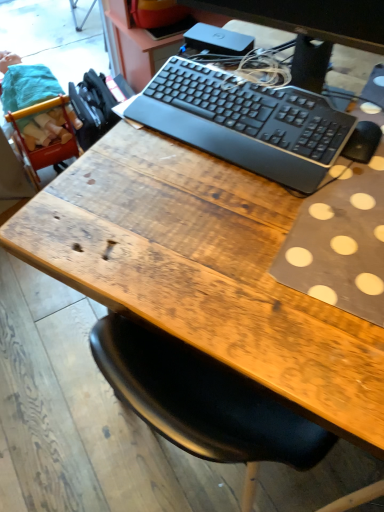
Where is `black plastic keyboard at center`? black plastic keyboard at center is located at coordinates (246, 122).

Measure the distance between black plastic keyboard at center and camera.

The depth of black plastic keyboard at center is 76.55 centimeters.

What is the approximate width of black plastic keyboard at center?

The width of black plastic keyboard at center is 8.57 inches.

The image size is (384, 512). What do you see at coordinates (246, 122) in the screenshot?
I see `black plastic keyboard at center` at bounding box center [246, 122].

What do you see at coordinates (310, 28) in the screenshot? I see `black plastic keyboard at upper center` at bounding box center [310, 28].

Where is `black plastic keyboard at upper center`? This screenshot has height=512, width=384. black plastic keyboard at upper center is located at coordinates pyautogui.click(x=310, y=28).

This screenshot has height=512, width=384. In order to click on black plastic keyboard at center in this screenshot , I will do `click(246, 122)`.

Considering the positions of objects black plastic keyboard at upper center and black plastic keyboard at center in the image provided, who is more to the left, black plastic keyboard at upper center or black plastic keyboard at center?

black plastic keyboard at center.

Is black plastic keyboard at upper center closer to the viewer compared to black plastic keyboard at center?

Yes, black plastic keyboard at upper center is closer to the viewer.

Which is less distant, (313,24) or (249,156)?

Clearly, point (313,24) is closer to the camera than point (249,156).

From the image's perspective, is black plastic keyboard at upper center located above black plastic keyboard at center?

Yes, from the image's perspective, black plastic keyboard at upper center is above black plastic keyboard at center.

From a real-world perspective, is black plastic keyboard at upper center above or below black plastic keyboard at center?

Clearly, from a real-world perspective, black plastic keyboard at upper center is above black plastic keyboard at center.

Which of these two, black plastic keyboard at upper center or black plastic keyboard at center, is wider?

With larger width is black plastic keyboard at center.

Considering the sizes of objects black plastic keyboard at upper center and black plastic keyboard at center in the image provided, who is shorter, black plastic keyboard at upper center or black plastic keyboard at center?

Standing shorter between the two is black plastic keyboard at center.

Between black plastic keyboard at upper center and black plastic keyboard at center, which one has larger size?

Bigger between the two is black plastic keyboard at upper center.

Is black plastic keyboard at upper center situated inside black plastic keyboard at center or outside?

black plastic keyboard at upper center cannot be found inside black plastic keyboard at center.

Is black plastic keyboard at upper center with black plastic keyboard at center?

No, black plastic keyboard at upper center is not making contact with black plastic keyboard at center.

Does black plastic keyboard at upper center turn towards black plastic keyboard at center?

Result: Yes, black plastic keyboard at upper center is aimed at black plastic keyboard at center.

From the picture: How far apart are black plastic keyboard at upper center and black plastic keyboard at center?

black plastic keyboard at upper center and black plastic keyboard at center are 14.60 centimeters apart.

Locate an element on the screen. computer keyboard below the black plastic keyboard at upper center (from the image's perspective) is located at coordinates 246,122.

Considering the relative positions of black plastic keyboard at center and black plastic keyboard at upper center in the image provided, is black plastic keyboard at center to the left or to the right of black plastic keyboard at upper center?

black plastic keyboard at center is to the left of black plastic keyboard at upper center.

Which is behind, black plastic keyboard at center or black plastic keyboard at upper center?

black plastic keyboard at center is further from the camera.

Considering the points (261, 115) and (374, 37), which point is in front, point (261, 115) or point (374, 37)?

The point (374, 37) is closer to the camera.

From the image's perspective, is black plastic keyboard at center located above or below black plastic keyboard at upper center?

black plastic keyboard at center is below black plastic keyboard at upper center.

From a real-world perspective, is black plastic keyboard at center located higher than black plastic keyboard at upper center?

No, from a real-world perspective, black plastic keyboard at center is not over black plastic keyboard at upper center

Is black plastic keyboard at center wider or thinner than black plastic keyboard at upper center?

Clearly, black plastic keyboard at center has more width compared to black plastic keyboard at upper center.

Consider the image. Which of these two, black plastic keyboard at center or black plastic keyboard at upper center, stands taller?

black plastic keyboard at upper center is taller.

Considering the relative sizes of black plastic keyboard at center and black plastic keyboard at upper center in the image provided, is black plastic keyboard at center smaller than black plastic keyboard at upper center?

Yes.

Is black plastic keyboard at center spatially inside black plastic keyboard at upper center, or outside of it?

black plastic keyboard at center is located beyond the bounds of black plastic keyboard at upper center.

Is black plastic keyboard at center not near black plastic keyboard at upper center?

black plastic keyboard at center is near black plastic keyboard at upper center, not far away.

Could you tell me if black plastic keyboard at center is facing black plastic keyboard at upper center?

No.

What's the angular difference between black plastic keyboard at center and black plastic keyboard at upper center's facing directions?

There is a 2.78-degree angle between the facing directions of black plastic keyboard at center and black plastic keyboard at upper center.

Find the location of a particular element. The image size is (384, 512). computer keyboard below the black plastic keyboard at upper center (from the image's perspective) is located at coordinates (x=246, y=122).

Locate an element on the screen. computer monitor on the right of the black plastic keyboard at center is located at coordinates (310, 28).

Where is `computer monitor above the black plastic keyboard at center (from the image's perspective)`? The height and width of the screenshot is (512, 384). computer monitor above the black plastic keyboard at center (from the image's perspective) is located at coordinates (310, 28).